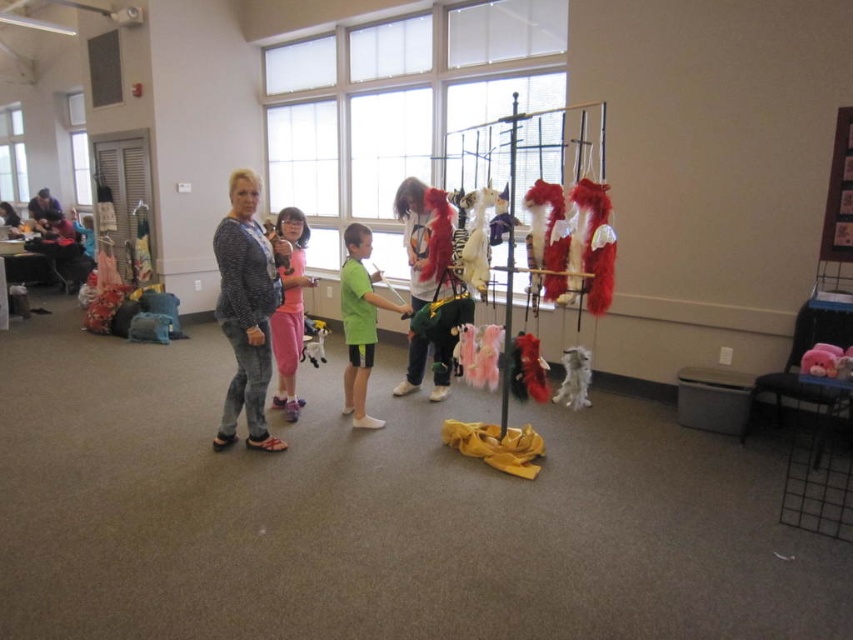
You are organizing a costume party and need to decide which costume to place first on the display rack. Since the green matte shirt at center and the white fluffy dog at center are both in the center, which one should you place first to ensure they both fit on the rack?

The green matte shirt at center has a larger size compared to the white fluffy dog at center, so you should place the white fluffy dog at center first to ensure both can fit on the display rack.

You are standing in the center of the room and see the point at coordinates (247, 310). What object is located at that point?

The point at coordinates (247, 310) is located on the speckled sweater at center.